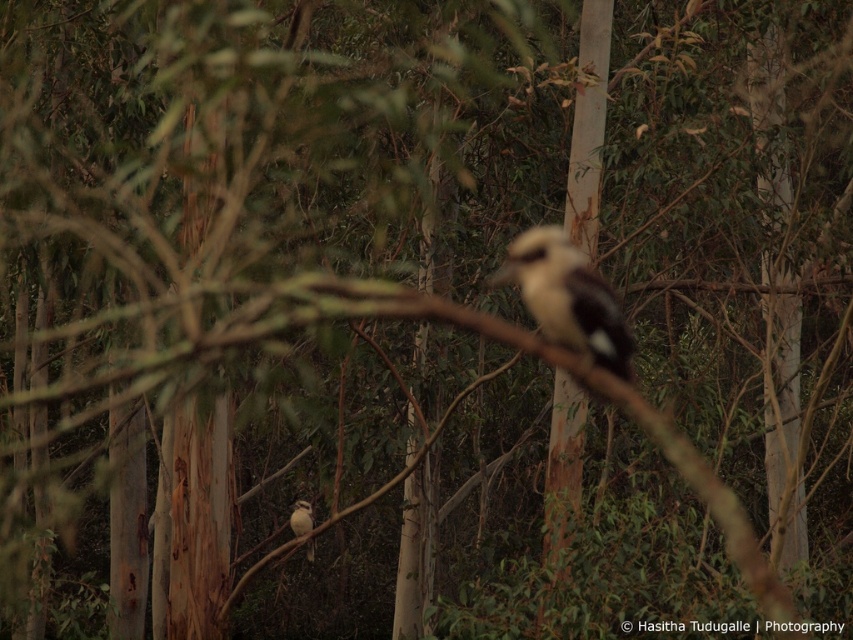
Does point (508, 266) come behind point (310, 554)?

That is False.

Between white-brown speckled bird at center and white matte bird at center, which one appears on the left side from the viewer's perspective?

white matte bird at center

Is point (554, 278) in front of point (306, 550)?

Yes, point (554, 278) is in front of point (306, 550).

I want to click on white-brown speckled bird at center, so click(x=567, y=298).